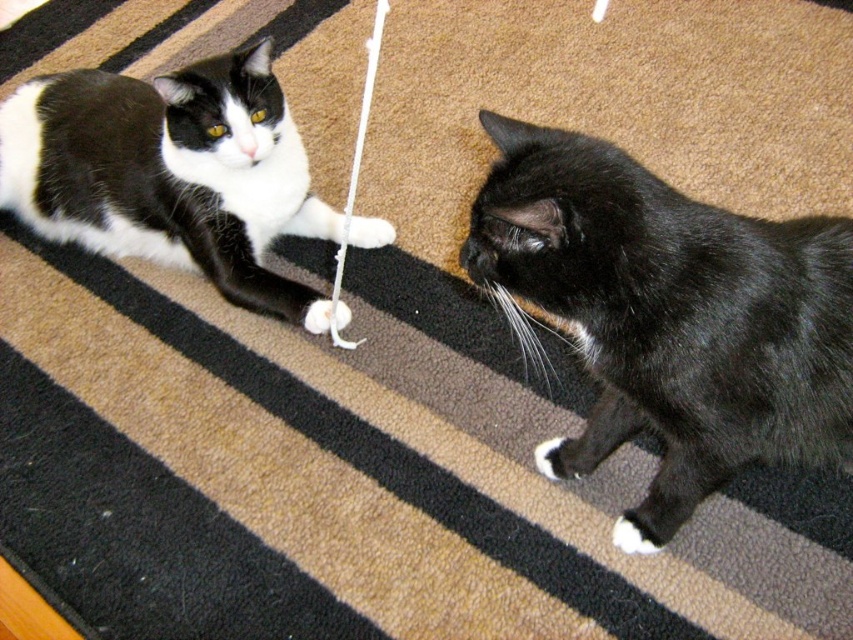
Question: Estimate the real-world distances between objects in this image. Which object is closer to the black fur cat at center?

Choices:
 (A) black matte fur cat at upper left
 (B) white fuzzy string at center

Answer: (B)

Question: Among these objects, which one is nearest to the camera?

Choices:
 (A) black matte fur cat at upper left
 (B) white fuzzy string at center

Answer: (B)

Question: Can you confirm if black fur cat at center is positioned above black matte fur cat at upper left?

Choices:
 (A) yes
 (B) no

Answer: (B)

Question: Can you confirm if black matte fur cat at upper left is positioned below white fuzzy string at center?

Choices:
 (A) no
 (B) yes

Answer: (B)

Question: Which of these objects is positioned closest to the black fur cat at center?

Choices:
 (A) white fuzzy string at center
 (B) black matte fur cat at upper left

Answer: (A)

Question: Where is black matte fur cat at upper left located in relation to white fuzzy string at center in the image?

Choices:
 (A) right
 (B) left

Answer: (B)